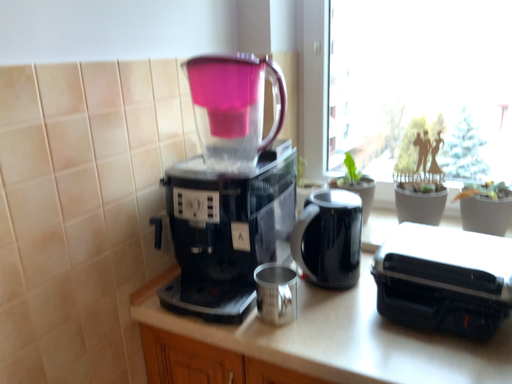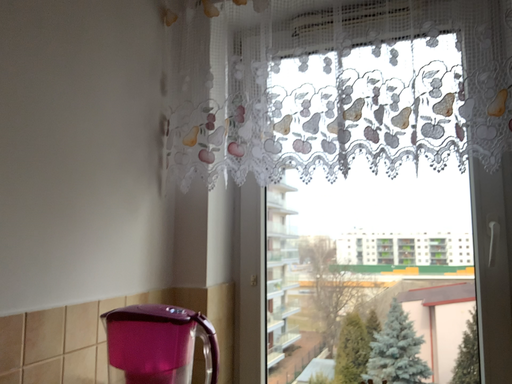
Question: How did the camera likely rotate when shooting the video?

Choices:
 (A) rotated right
 (B) rotated left

Answer: (A)